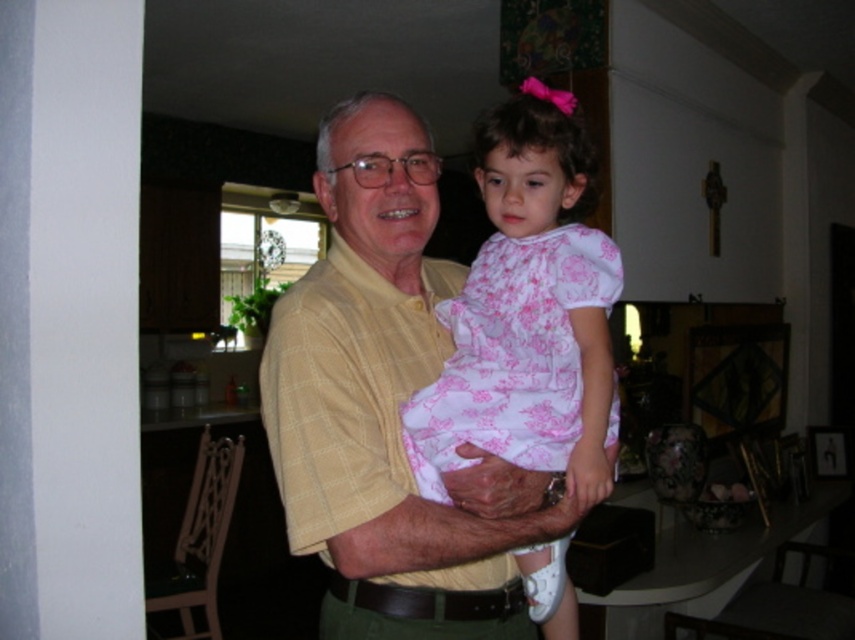
You are a photographer setting up for a family portrait. You need to ensure that the yellow checkered shirt at center and the pink floral dress at center are at least 5 inches apart to avoid overlapping in the photo. Based on the current positioning, will they be too close?

The yellow checkered shirt at center and the pink floral dress at center are 4.52 inches apart, which is less than the required 5 inches. Therefore, they will be too close and may overlap in the photo.

You are a photographer setting up a shot in this scene. You want to focus on the point closer to the camera between the two points, point (565, 506) and point (428, 413). Which point should you choose?

Point (565, 506) is further to the camera than point (428, 413), so you should choose point (565, 506) as it is closer to the camera.